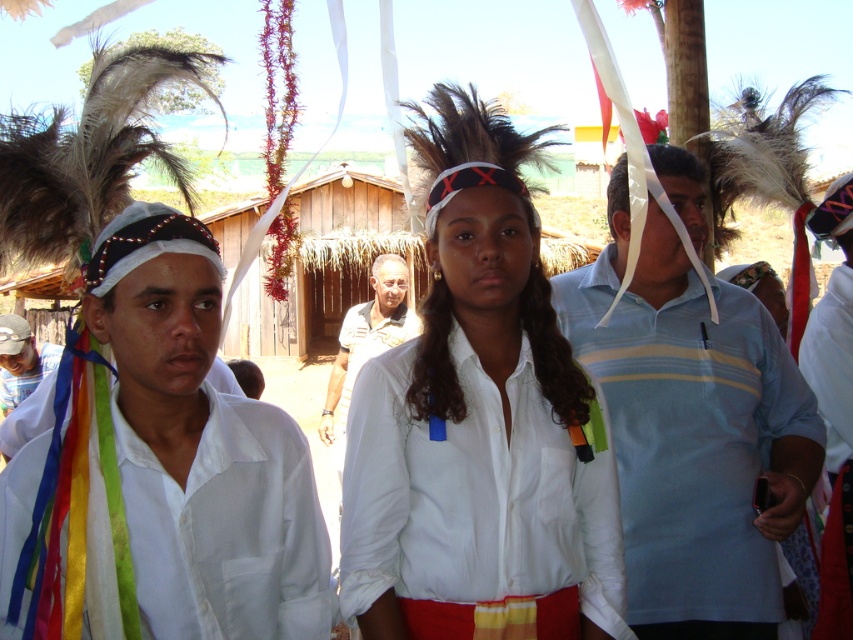
Question: Can you confirm if light blue striped polo shirt at center is wider than black fabric shirt at center?

Choices:
 (A) no
 (B) yes

Answer: (A)

Question: Is light blue striped polo shirt at center to the right of white fabric at left from the viewer's perspective?

Choices:
 (A) yes
 (B) no

Answer: (A)

Question: Considering the real-world distances, which object is closest to the white matte shirt at center?

Choices:
 (A) light blue striped polo shirt at center
 (B) black fabric shirt at center
 (C) white matte headdress at left

Answer: (A)

Question: Considering the real-world distances, which object is farthest from the light blue striped polo shirt at center?

Choices:
 (A) black fabric shirt at center
 (B) white fabric at left

Answer: (B)

Question: Can you confirm if white matte headdress at left is positioned above white fabric at left?

Choices:
 (A) yes
 (B) no

Answer: (B)

Question: Which object appears farthest from the camera in this image?

Choices:
 (A) white fabric at left
 (B) white matte headdress at left
 (C) white matte shirt at center
 (D) light blue striped polo shirt at center

Answer: (A)